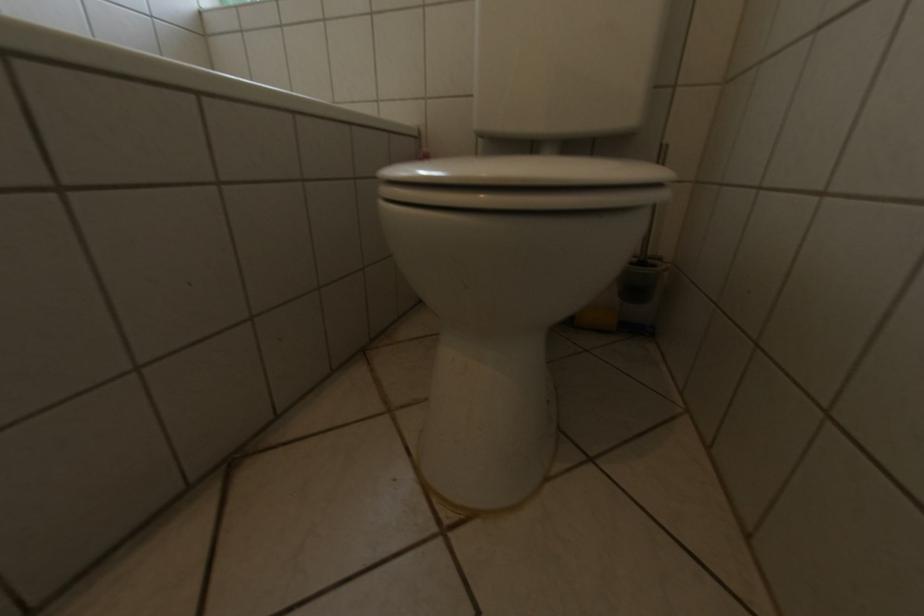
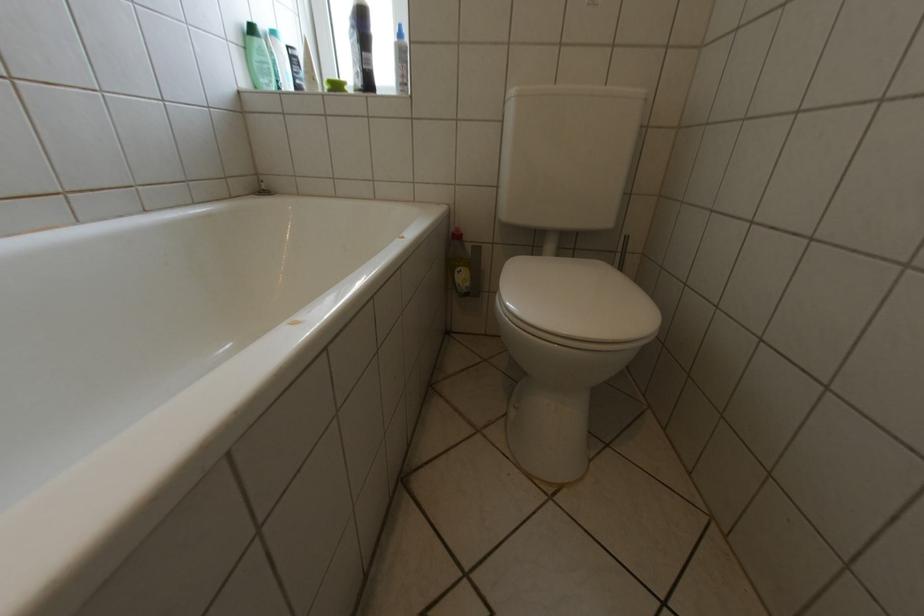
Question: The camera is either moving clockwise (left) or counter-clockwise (right) around the object. The first image is from the beginning of the video and the second image is from the end. Is the camera moving left or right when shooting the video?

Choices:
 (A) Left
 (B) Right

Answer: (A)